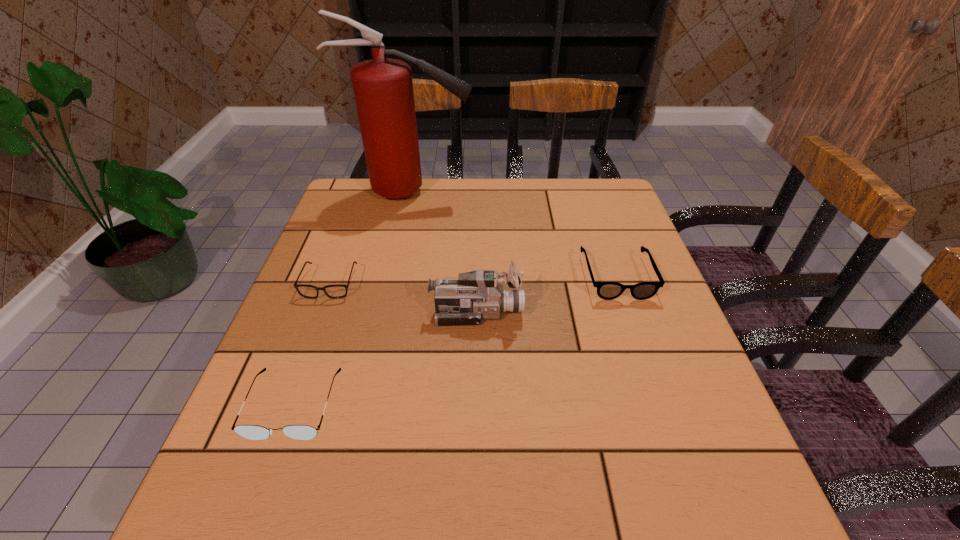
Where is `free space at the near right corner of the desktop`? This screenshot has height=540, width=960. free space at the near right corner of the desktop is located at coordinates (742, 484).

This screenshot has height=540, width=960. I want to click on vacant space that's between the farthest object and the nearest object, so click(352, 299).

Where is `vacant space that's between the fire extinguisher and the nearest spectacles`? Image resolution: width=960 pixels, height=540 pixels. vacant space that's between the fire extinguisher and the nearest spectacles is located at coordinates (352, 299).

Locate an element on the screen. This screenshot has height=540, width=960. vacant space in between the nearest spectacles and the shortest spectacles is located at coordinates (312, 344).

The width and height of the screenshot is (960, 540). Find the location of `free space between the camcorder and the nearest object`. free space between the camcorder and the nearest object is located at coordinates (385, 359).

The height and width of the screenshot is (540, 960). What are the coordinates of `vacant point located between the nearest object and the fire extinguisher` in the screenshot? It's located at (352, 299).

At what (x,y) coordinates should I click in order to perform the action: click on free spot between the rightmost spectacles and the camcorder. Please return your answer as a coordinate pair (x, y). This screenshot has height=540, width=960. Looking at the image, I should click on pos(546,294).

At what (x,y) coordinates should I click in order to perform the action: click on free point between the nearest spectacles and the rightmost object. Please return your answer as a coordinate pair (x, y). This screenshot has width=960, height=540. Looking at the image, I should click on (455, 340).

Where is `empty space that is in between the second tallest object and the nearest spectacles`? empty space that is in between the second tallest object and the nearest spectacles is located at coordinates (385, 359).

This screenshot has height=540, width=960. What are the coordinates of `vacant area between the second tallest object and the shortest object` in the screenshot? It's located at (403, 298).